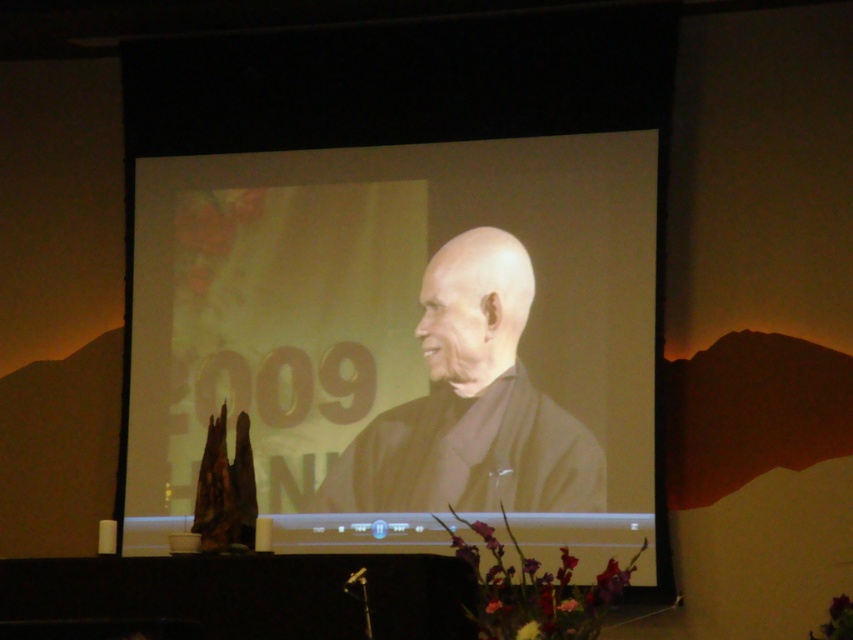
Consider the image. You are an event organizer setting up a presentation. You need to place a new projector that will project an image onto the matte black screen at center. The projector must be placed at coordinates point (399, 342). Can you confirm if this coordinate is correct for the screen?

Yes, the point (399, 342) corresponds to the matte black screen at center, so placing the projector there will project the image onto the correct location.

You are sitting in the front row of the presentation hall and want to take a photo of both the matte black screen at center and the black matte kimono at center. Which object will appear larger in your photo?

The matte black screen at center will appear larger in your photo because it is closer to the viewer than the black matte kimono at center.